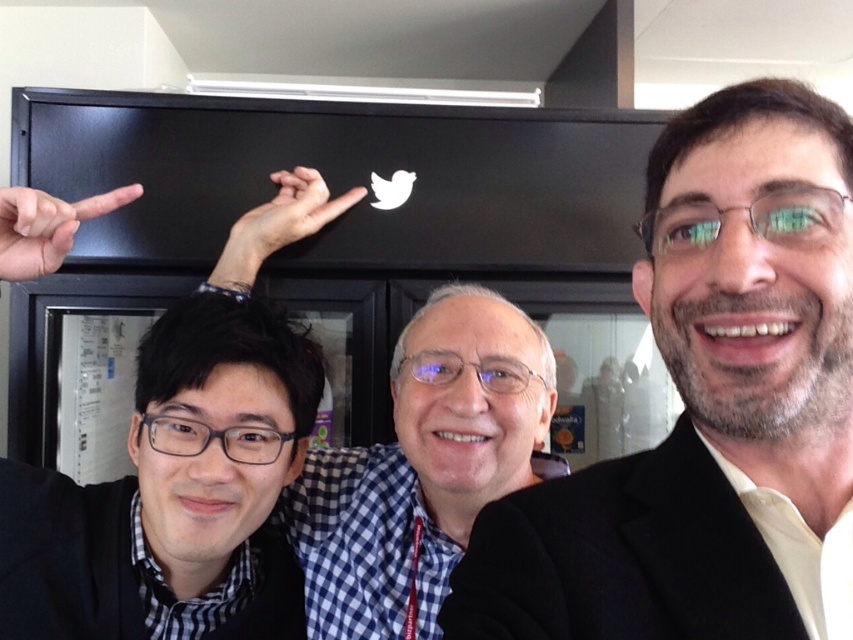
I want to click on black matte laptop at upper left, so click(x=225, y=397).

Who is more distant from viewer, (225, 477) or (65, 208)?

The point (225, 477) is behind.

Where is `black matte laptop at upper left`? black matte laptop at upper left is located at coordinates (225, 397).

How distant is smooth black suit at right from black matte laptop at upper left?

smooth black suit at right and black matte laptop at upper left are 50.02 centimeters apart from each other.

Can you confirm if smooth black suit at right is positioned to the right of black matte laptop at upper left?

Yes, smooth black suit at right is to the right of black matte laptop at upper left.

Between point (682, 170) and point (158, 532), which one is positioned behind?

The point (158, 532) is behind.

This screenshot has height=640, width=853. Identify the location of smooth black suit at right. (701, 397).

Does smooth black suit at right have a lesser height compared to matte black hand at center?

In fact, smooth black suit at right may be taller than matte black hand at center.

Who is higher up, smooth black suit at right or matte black hand at center?

Positioned higher is matte black hand at center.

Is point (711, 577) behind point (251, 218)?

No, it is not.

Find the location of a particular element. This screenshot has width=853, height=640. smooth black suit at right is located at coordinates tap(701, 397).